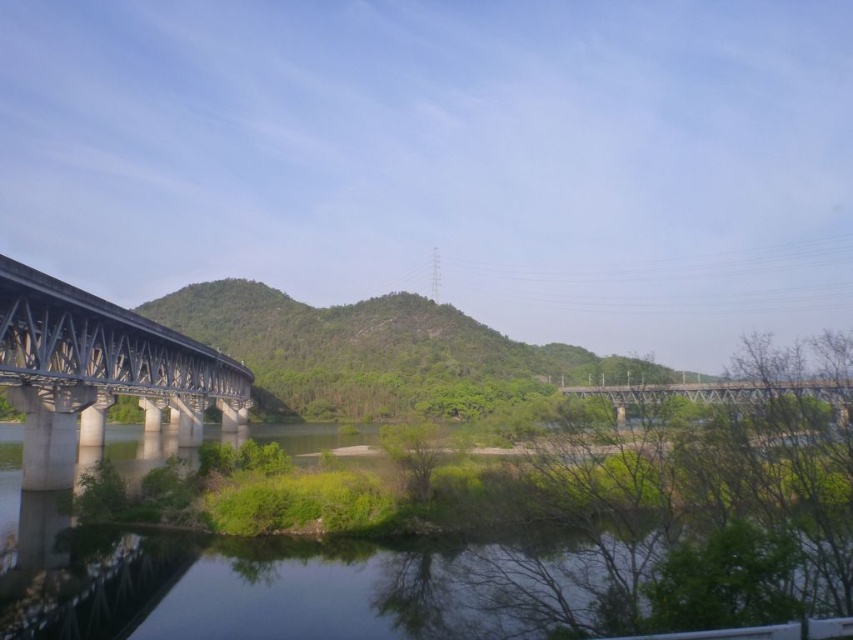
You are a photographer planning to capture the clear water at lower left and the metallic gray bridge at center in a single frame. Based on the scene, which object will occupy a larger portion of the photo?

The metallic gray bridge at center will occupy a larger portion of the photo since it is bigger than the clear water at lower left.

You are a kayaker planning to navigate the river near the clear water at lower left and the concrete bridge at left. Which object should you avoid hitting if you want to stay on the correct path towards the middle of the river?

You should avoid hitting the concrete bridge at left because the clear water at lower left is positioned on the right side of concrete bridge at left, indicating the bridge is on the left side of the river path.

You are standing at the origin point of the coordinate system in the image. Can you determine if the clear water at lower left is positioned to the right or left of the origin?

The clear water at lower left is located at point (x=399, y=588), which means it is to the right of the origin since the x coordinate is greater than 0.5.